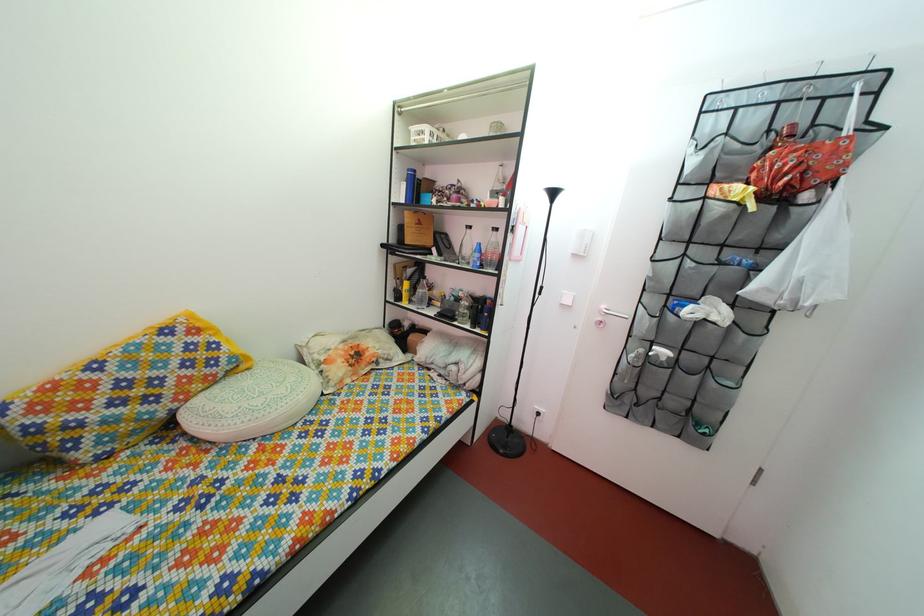
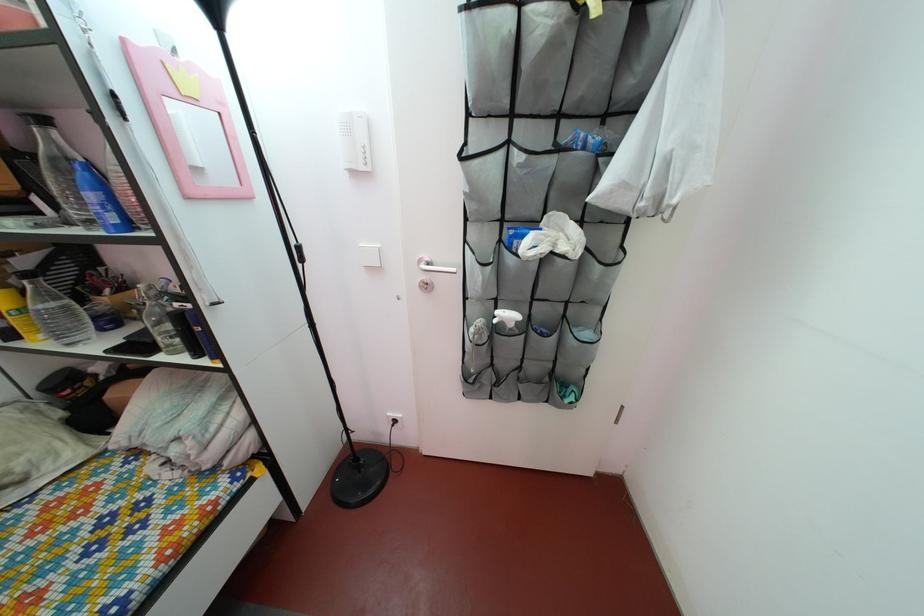
Find the pixel in the second image that matches (419,280) in the first image.

(32, 270)